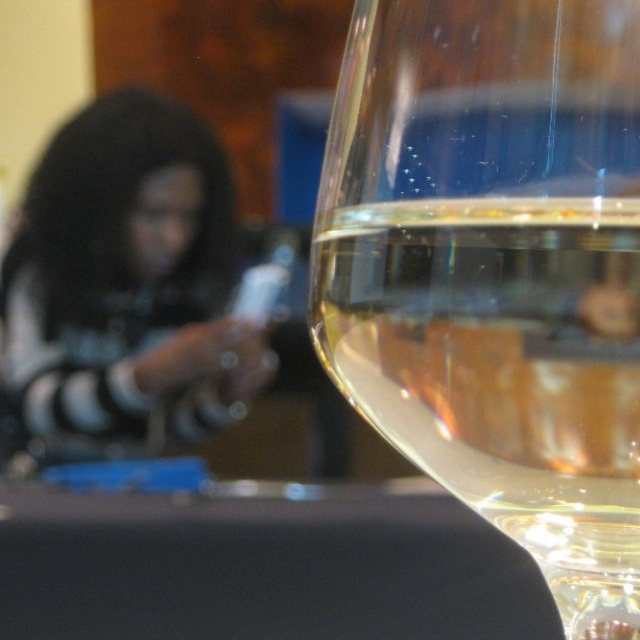
Between clear glass wine glass at right and black matte/soft fabric at left, which one is positioned lower?

clear glass wine glass at right is lower down.

Does point (355, 349) come farther from viewer compared to point (172, 314)?

No, it is in front of (172, 314).

Identify the location of clear glass wine glass at right. (496, 272).

You are a GUI agent. You are given a task and a screenshot of the screen. Output one action in this format:
    pyautogui.click(x=<x>, y=<y>)
    Task: Click on the clear glass wine glass at right
    This screenshot has height=640, width=640.
    Given the screenshot: What is the action you would take?
    pyautogui.click(x=496, y=272)